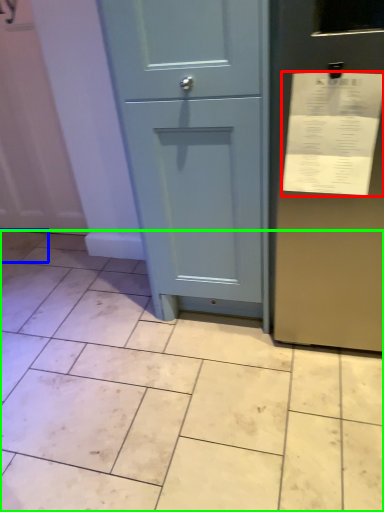
Question: Estimate the real-world distances between objects in this image. Which object is closer to receipt (highlighted by a red box), ceramic tile (highlighted by a blue box) or ceramic tile (highlighted by a green box)?

Choices:
 (A) ceramic tile
 (B) ceramic tile

Answer: (B)